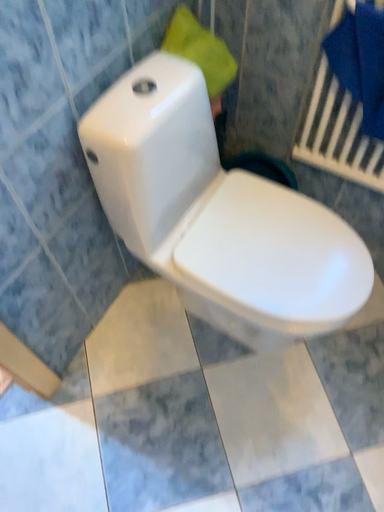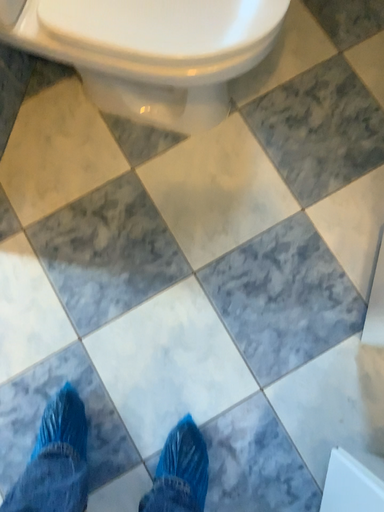
Question: Which way did the camera rotate in the video?

Choices:
 (A) rotated downward
 (B) rotated upward

Answer: (A)